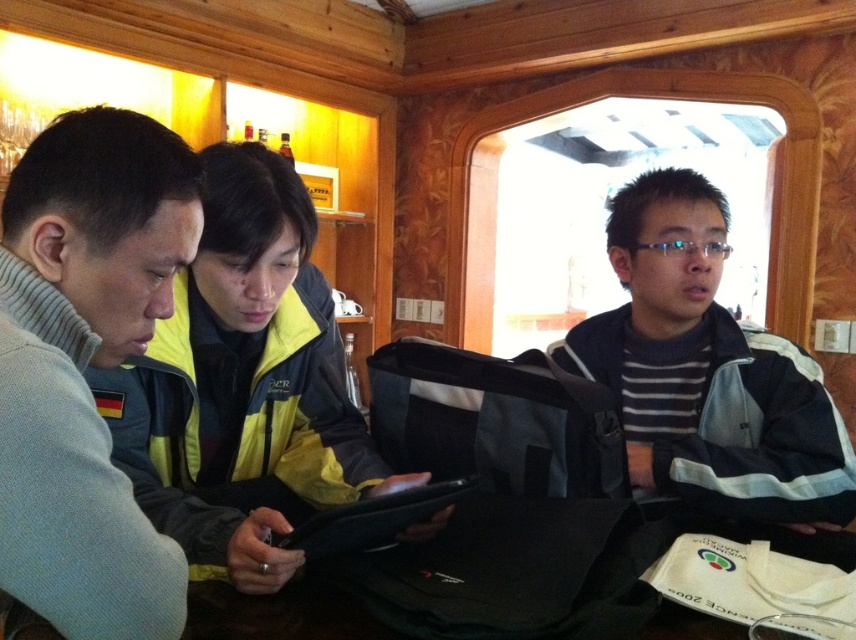
Is matte gray sweater at left positioned behind yellow reflective jacket at center?

No, matte gray sweater at left is in front of yellow reflective jacket at center.

Who is more distant from viewer, (134, 333) or (168, 509)?

The point (168, 509) is behind.

Find the location of a particular element. The height and width of the screenshot is (640, 856). matte gray sweater at left is located at coordinates (85, 365).

Who is positioned more to the left, matte gray sweater at left or striped knit sweater at center?

matte gray sweater at left is more to the left.

Can you confirm if matte gray sweater at left is positioned to the right of striped knit sweater at center?

No, matte gray sweater at left is not to the right of striped knit sweater at center.

Does point (147, 140) lie behind point (613, 324)?

No, (147, 140) is in front of (613, 324).

Locate an element on the screen. This screenshot has width=856, height=640. matte gray sweater at left is located at coordinates (85, 365).

Is point (307, 252) farther from camera compared to point (638, 310)?

No, (307, 252) is closer to viewer.

What do you see at coordinates (241, 385) in the screenshot?
I see `yellow reflective jacket at center` at bounding box center [241, 385].

What are the coordinates of `yellow reflective jacket at center` in the screenshot? It's located at click(x=241, y=385).